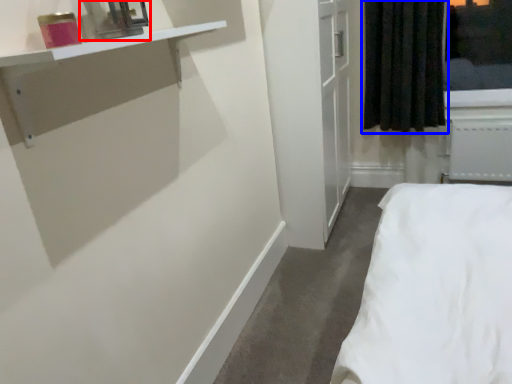
Question: Which object appears closest to the camera in this image, medicine cabinet (highlighted by a red box) or curtain (highlighted by a blue box)?

Choices:
 (A) medicine cabinet
 (B) curtain

Answer: (A)